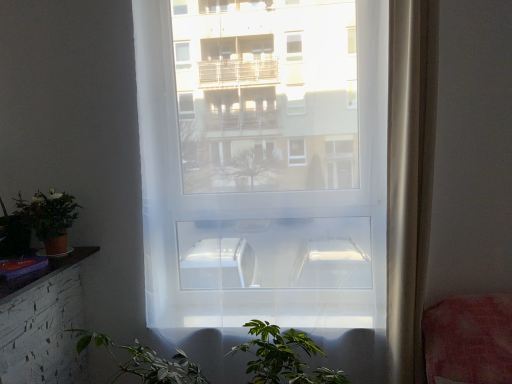
Question: Considering the relative sizes of sheer white curtain at right and transparent plastic window at center in the image provided, is sheer white curtain at right thinner than transparent plastic window at center?

Choices:
 (A) yes
 (B) no

Answer: (B)

Question: Is sheer white curtain at right aimed at transparent plastic window at center?

Choices:
 (A) no
 (B) yes

Answer: (A)

Question: Can you confirm if sheer white curtain at right is positioned to the right of transparent plastic window at center?

Choices:
 (A) no
 (B) yes

Answer: (B)

Question: Is sheer white curtain at right wider than transparent plastic window at center?

Choices:
 (A) no
 (B) yes

Answer: (B)

Question: Considering the relative sizes of sheer white curtain at right and transparent plastic window at center in the image provided, is sheer white curtain at right bigger than transparent plastic window at center?

Choices:
 (A) yes
 (B) no

Answer: (B)

Question: Do you think sheer white curtain at right is within transparent plastic window at center, or outside of it?

Choices:
 (A) outside
 (B) inside

Answer: (A)

Question: In terms of width, does sheer white curtain at right look wider or thinner when compared to transparent plastic window at center?

Choices:
 (A) wide
 (B) thin

Answer: (A)

Question: Is sheer white curtain at right taller or shorter than transparent plastic window at center?

Choices:
 (A) tall
 (B) short

Answer: (B)

Question: From a real-world perspective, is sheer white curtain at right positioned above or below transparent plastic window at center?

Choices:
 (A) below
 (B) above

Answer: (A)

Question: From their relative heights in the image, would you say matte terracotta pot at lower left is taller or shorter than transparent plastic window at center?

Choices:
 (A) tall
 (B) short

Answer: (B)

Question: From a real-world perspective, is matte terracotta pot at lower left above or below transparent plastic window at center?

Choices:
 (A) above
 (B) below

Answer: (B)

Question: Considering the positions of matte terracotta pot at lower left and transparent plastic window at center in the image, is matte terracotta pot at lower left wider or thinner than transparent plastic window at center?

Choices:
 (A) wide
 (B) thin

Answer: (A)

Question: From the image's perspective, relative to transparent plastic window at center, is matte terracotta pot at lower left above or below?

Choices:
 (A) below
 (B) above

Answer: (A)

Question: Is transparent plastic window at center bigger or smaller than sheer white curtain at right?

Choices:
 (A) small
 (B) big

Answer: (B)

Question: From a real-world perspective, is transparent plastic window at center above or below sheer white curtain at right?

Choices:
 (A) above
 (B) below

Answer: (A)